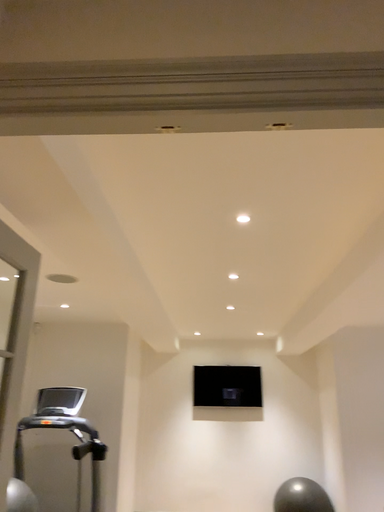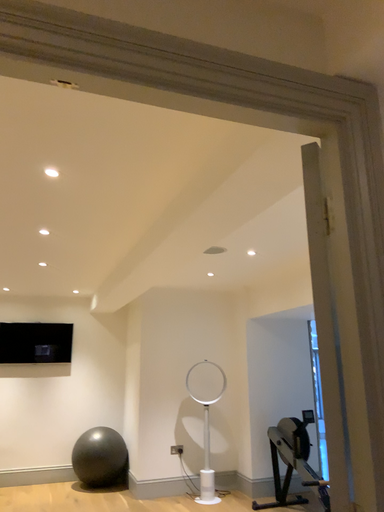
Question: Which way did the camera rotate in the video?

Choices:
 (A) rotated upward
 (B) rotated downward

Answer: (B)